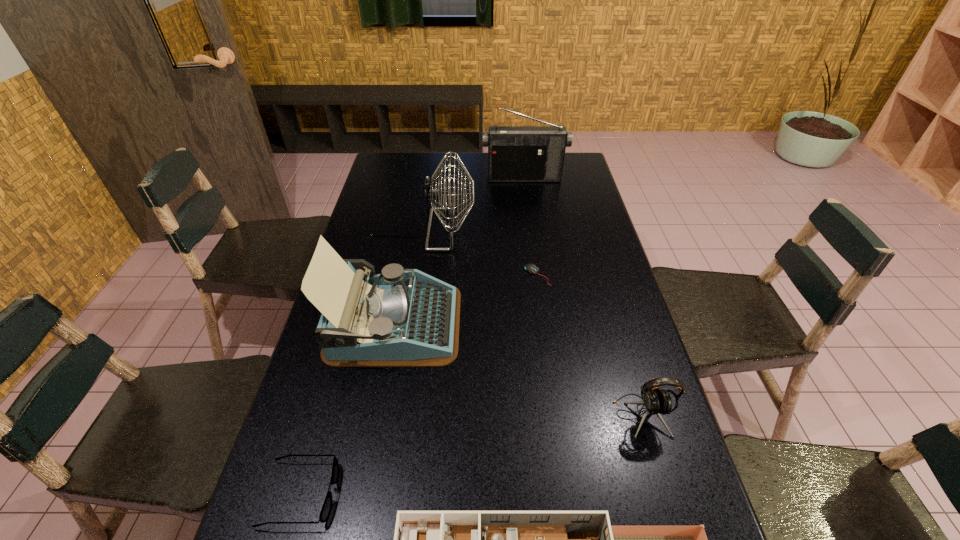
The width and height of the screenshot is (960, 540). What are the coordinates of `object located at the far right corner` in the screenshot? It's located at (515, 153).

Find the location of a particular element. This screenshot has height=540, width=960. free space at the far edge is located at coordinates click(473, 163).

Find the location of `free region at the left edge`. free region at the left edge is located at coordinates (388, 244).

Locate an element on the screen. The image size is (960, 540). vacant space at the right edge is located at coordinates (604, 340).

Find the location of `vacant space that's between the farthest object and the fourth shortest object`. vacant space that's between the farthest object and the fourth shortest object is located at coordinates (583, 297).

This screenshot has width=960, height=540. I want to click on vacant area between the fourth shortest object and the mouse, so click(589, 346).

You are a GUI agent. You are given a task and a screenshot of the screen. Output one action in this format:
    pyautogui.click(x=<x>, y=<y>)
    Task: Click on the vacant region between the spectacles and the earphone
    The image size is (960, 540).
    Given the screenshot: What is the action you would take?
    pyautogui.click(x=471, y=455)

Locate an element on the screen. The height and width of the screenshot is (540, 960). vacant space that's between the farthest object and the fifth shortest object is located at coordinates (459, 251).

Identify the location of vacant space in between the earphone and the fifth shortest object. The height and width of the screenshot is (540, 960). (518, 370).

Where is `the closest object relative to the fan`? the closest object relative to the fan is located at coordinates (398, 318).